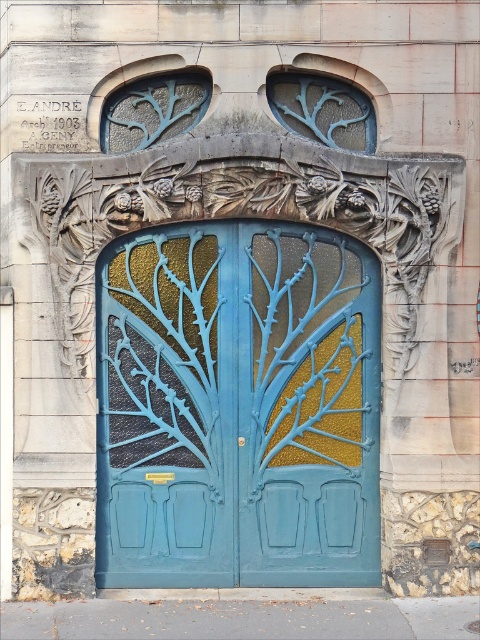
You are standing in front of the Art Nouveau door and see two points marked on the door. The first point is at coordinate point (x=96, y=532) and the second is at point (x=206, y=92). Which point is closer to you?

Point (x=96, y=532) is in front of point (x=206, y=92), so it is closer to you.

You are an architect examining the Art Nouveau door design. You need to determine the spatial relationship between the matte blue metal door at center and the translucent blue glass at upper left. Which object is positioned higher in the image?

The translucent blue glass at upper left is positioned higher than the matte blue metal door at center.